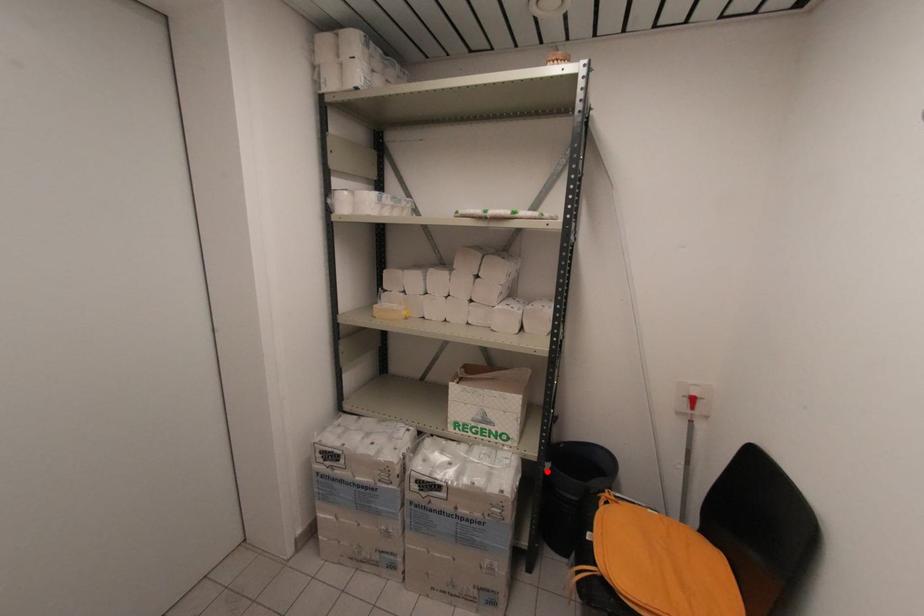
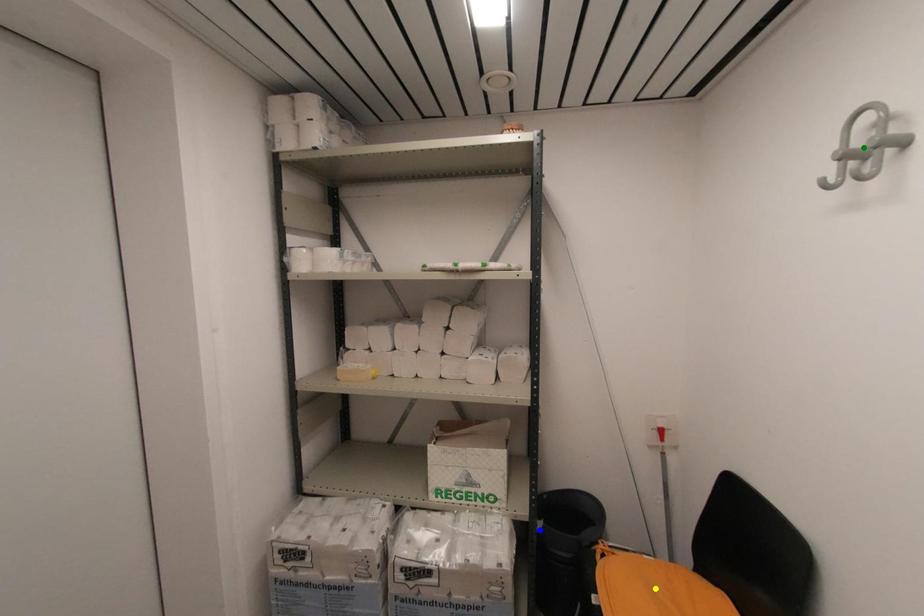
Question: I am providing you with two images of the same scene from different viewpoints. A red point is marked on the first image. You are given multiple points on the second image. Which mark in image 2 goes with the point in image 1?

Choices:
 (A) green point
 (B) yellow point
 (C) blue point

Answer: (C)